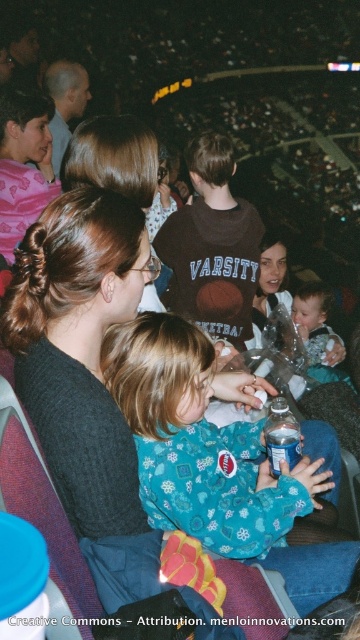
Question: Where is brown cotton shirt at center located in relation to clear plastic bottle at center in the image?

Choices:
 (A) left
 (B) right

Answer: (A)

Question: Does matte black shirt at upper left have a smaller size compared to clear plastic bottle at center?

Choices:
 (A) yes
 (B) no

Answer: (B)

Question: Among these objects, which one is farthest from the camera?

Choices:
 (A) matte black shirt at upper left
 (B) clear plastic bottle at center
 (C) brown cotton shirt at center
 (D) teal fleece pajamas at center

Answer: (A)

Question: Which point is farther from the camera taking this photo?

Choices:
 (A) (217, 321)
 (B) (81, 81)

Answer: (B)

Question: Does brown cotton shirt at center have a larger size compared to clear plastic bottle at center?

Choices:
 (A) yes
 (B) no

Answer: (A)

Question: Which object is the closest to the smooth plastic baby at center?

Choices:
 (A) teal fleece pajamas at center
 (B) clear plastic bottle at center
 (C) matte black shirt at upper left
 (D) brown cotton shirt at center

Answer: (D)